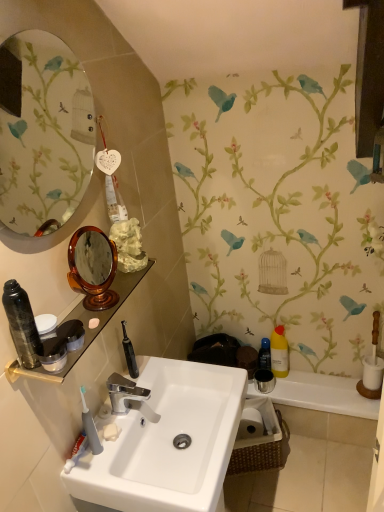
I want to click on spots to the right of yellow translucent bottle at right, arranged as the second toiletry when viewed from the back, so [321, 377].